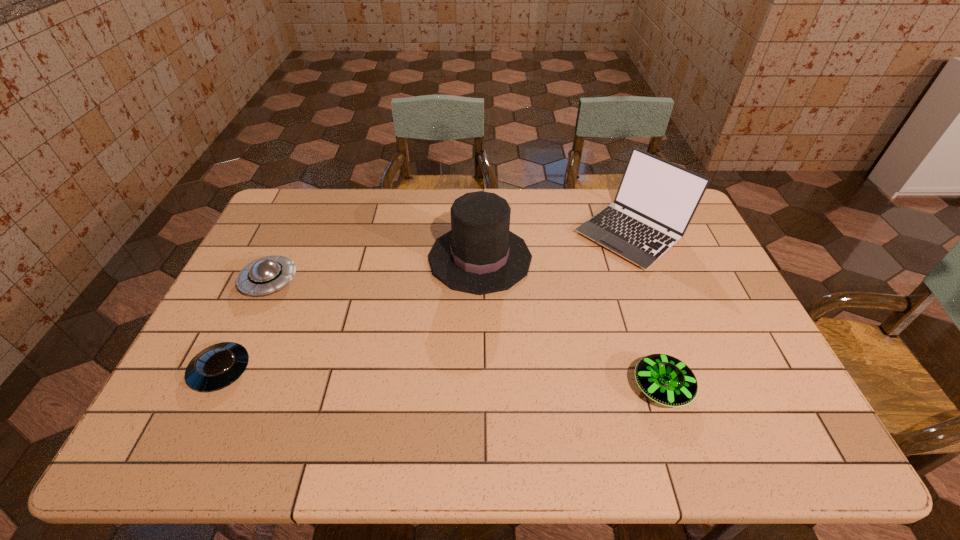
Where is `vacant space situated on the front of the third object from right to left with the decoration`? This screenshot has width=960, height=540. vacant space situated on the front of the third object from right to left with the decoration is located at coordinates (403, 258).

Locate an element on the screen. vacant position located on the back of the farthest saucer is located at coordinates (306, 202).

The width and height of the screenshot is (960, 540). In order to click on free space located 0.320m on the left of the rightmost saucer in this screenshot , I will do coord(501,387).

Where is `vacant space situated 0.140m on the back of the shortest object`? vacant space situated 0.140m on the back of the shortest object is located at coordinates (252, 307).

Find the location of a particular element. laptop_computer located in the far edge section of the desktop is located at coordinates (657, 196).

You are a GUI agent. You are given a task and a screenshot of the screen. Output one action in this format:
    pyautogui.click(x=<x>, y=<y>)
    Task: Click on the dress hat that is at the far edge
    The image size is (960, 540).
    Given the screenshot: What is the action you would take?
    pyautogui.click(x=479, y=255)

Identify the location of object at the right edge. (657, 196).

At what (x,y) coordinates should I click in order to perform the action: click on object that is at the far right corner. Please return your answer as a coordinate pair (x, y). Image resolution: width=960 pixels, height=540 pixels. Looking at the image, I should click on (657, 196).

Find the location of a particular element. The height and width of the screenshot is (540, 960). free space at the far edge is located at coordinates (549, 217).

The height and width of the screenshot is (540, 960). What are the coordinates of `vacant region at the near edge of the desktop` in the screenshot? It's located at (718, 437).